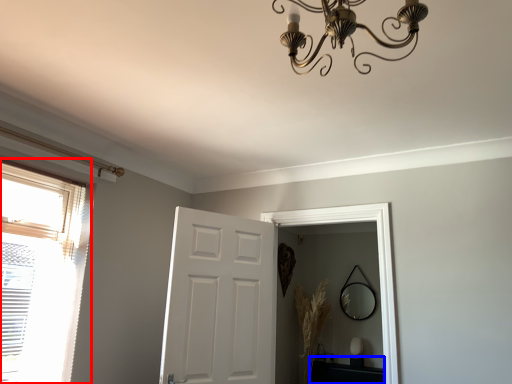
Question: Among these objects, which one is farthest to the camera, window (highlighted by a red box) or table (highlighted by a blue box)?

Choices:
 (A) window
 (B) table

Answer: (B)